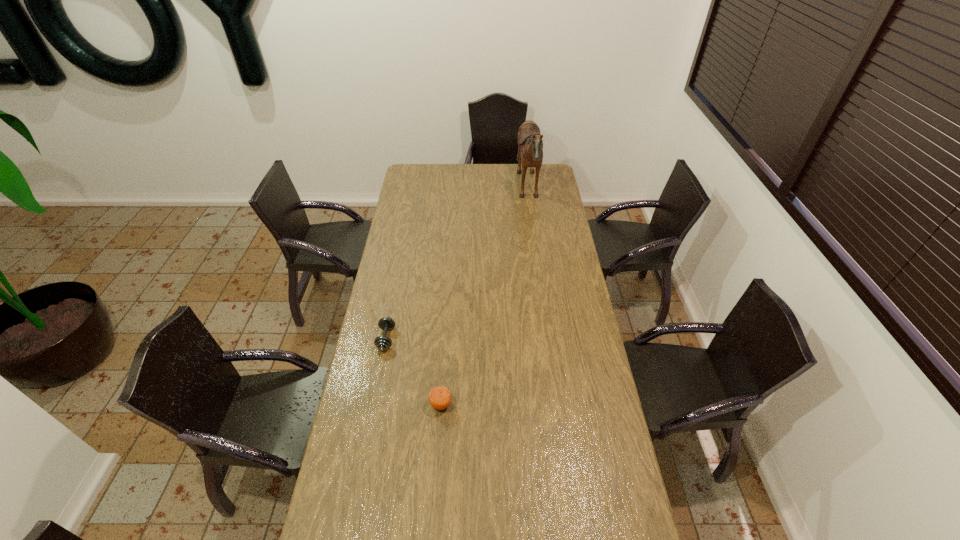
Locate an element on the screen. The image size is (960, 540). vacant position located 0.300m on the back of the second nearest object is located at coordinates (398, 274).

The image size is (960, 540). What are the coordinates of `object located at the far edge` in the screenshot? It's located at (530, 144).

Where is `object that is at the left edge`? object that is at the left edge is located at coordinates (382, 343).

Locate an element on the screen. object at the right edge is located at coordinates (530, 144).

At what (x,y) coordinates should I click in order to perform the action: click on object that is at the far right corner. Please return your answer as a coordinate pair (x, y). This screenshot has height=540, width=960. Looking at the image, I should click on click(530, 144).

In order to click on vacant space at the far edge of the desktop in this screenshot , I will do `click(492, 165)`.

The image size is (960, 540). In order to click on free space at the left edge of the desktop in this screenshot , I will do `click(370, 387)`.

Image resolution: width=960 pixels, height=540 pixels. Find the location of `vacant space at the right edge of the desktop`. vacant space at the right edge of the desktop is located at coordinates pyautogui.click(x=583, y=458).

This screenshot has height=540, width=960. Find the location of `vacant area that lies between the second nearest object and the saddle`. vacant area that lies between the second nearest object and the saddle is located at coordinates (457, 265).

Locate an element on the screen. free space between the orange and the shortest object is located at coordinates (414, 372).